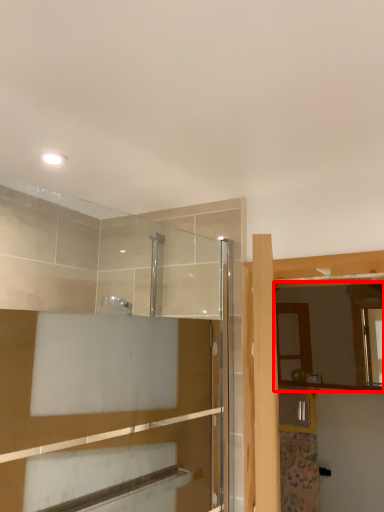
Question: Considering the relative positions of mirror (annotated by the red box) and screen door in the image provided, where is mirror (annotated by the red box) located with respect to the staircase?

Choices:
 (A) left
 (B) right

Answer: (B)